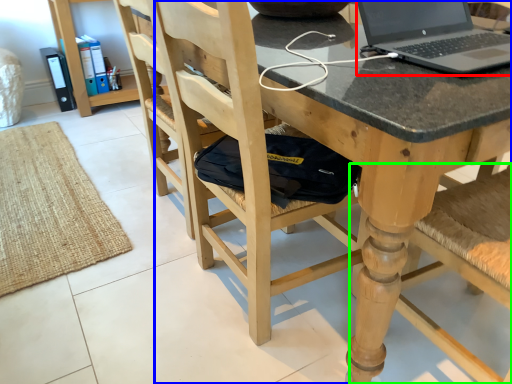
Question: Which is nearer to the laptop (highlighted by a red box)? chair (highlighted by a blue box) or chair (highlighted by a green box).

Choices:
 (A) chair
 (B) chair

Answer: (A)